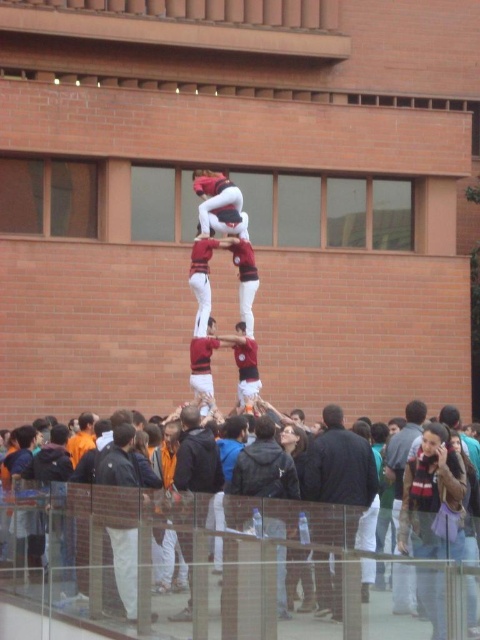
Does dark blue jacket at center have a greater width compared to maroon jersey at center?

Yes.

Can you confirm if dark blue jacket at center is shorter than maroon jersey at center?

Indeed, dark blue jacket at center has a lesser height compared to maroon jersey at center.

Which is in front, point (323, 486) or point (199, 349)?

Point (323, 486) is more forward.

Where is `dark blue jacket at center`? dark blue jacket at center is located at coordinates (337, 481).

Can you confirm if dark clothing crowd at lower center is smaller than dark blue jacket at center?

Incorrect, dark clothing crowd at lower center is not smaller in size than dark blue jacket at center.

Can you confirm if dark clothing crowd at lower center is positioned to the right of dark blue jacket at center?

No, dark clothing crowd at lower center is not to the right of dark blue jacket at center.

This screenshot has height=640, width=480. Describe the element at coordinates (239, 548) in the screenshot. I see `dark clothing crowd at lower center` at that location.

Image resolution: width=480 pixels, height=640 pixels. I want to click on dark clothing crowd at lower center, so click(239, 548).

The height and width of the screenshot is (640, 480). I want to click on dark gray hoodie at center, so click(195, 467).

Does dark gray hoodie at center have a larger size compared to maroon jersey at center?

Yes.

Find the location of a particular element. Image resolution: width=480 pixels, height=640 pixels. dark gray hoodie at center is located at coordinates (195, 467).